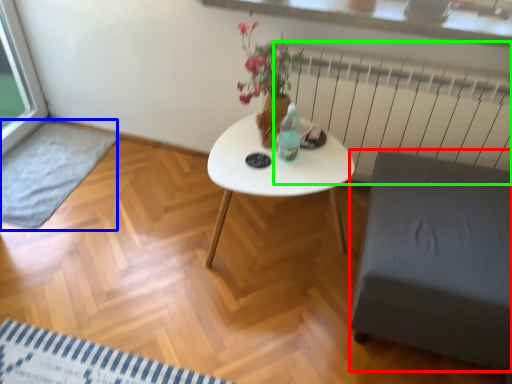
Question: Estimate the real-world distances between objects in this image. Which object is farther from armchair (highlighted by a red box), wide (highlighted by a blue box) or radiator (highlighted by a green box)?

Choices:
 (A) wide
 (B) radiator

Answer: (A)